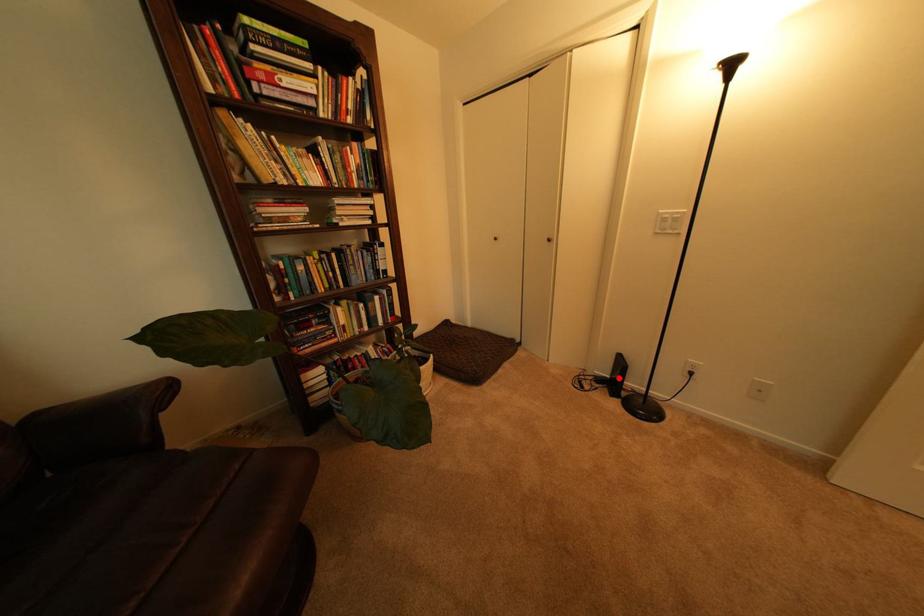
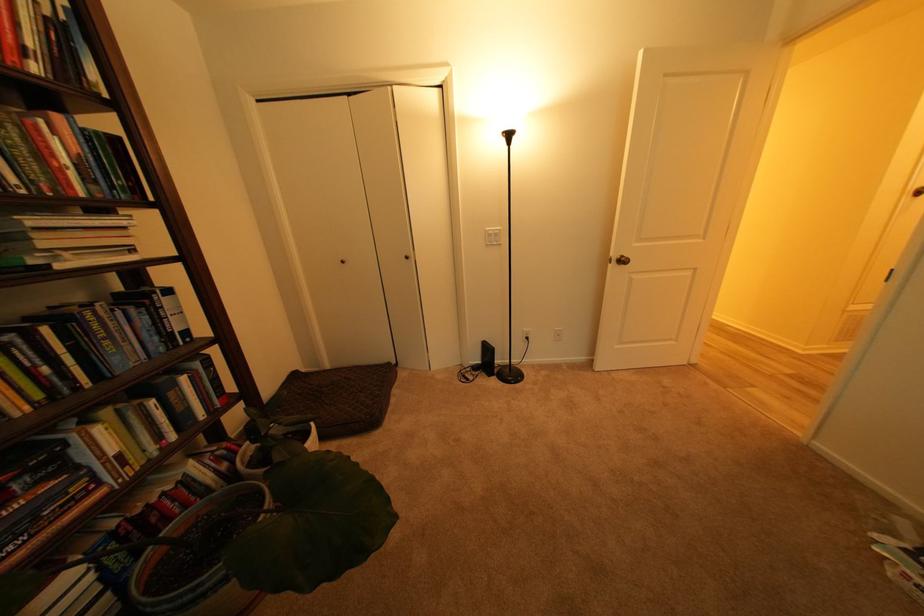
Question: I am providing you with two images of the same scene from different viewpoints. A red point is shown in image1. For the corresponding object point in image2, is it positioned nearer or farther from the camera?

Choices:
 (A) Nearer
 (B) Farther

Answer: (B)